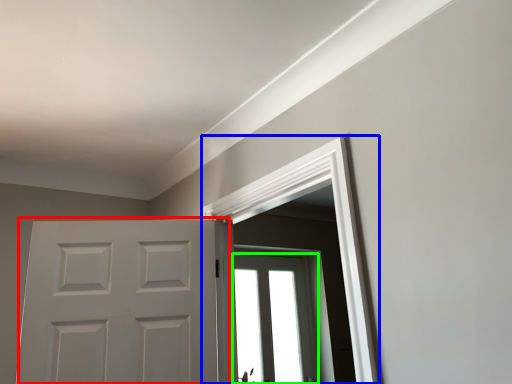
Question: Which object is positioned farthest from door (highlighted by a red box)? Select from window frame (highlighted by a blue box) and window (highlighted by a green box).

Choices:
 (A) window frame
 (B) window

Answer: (B)